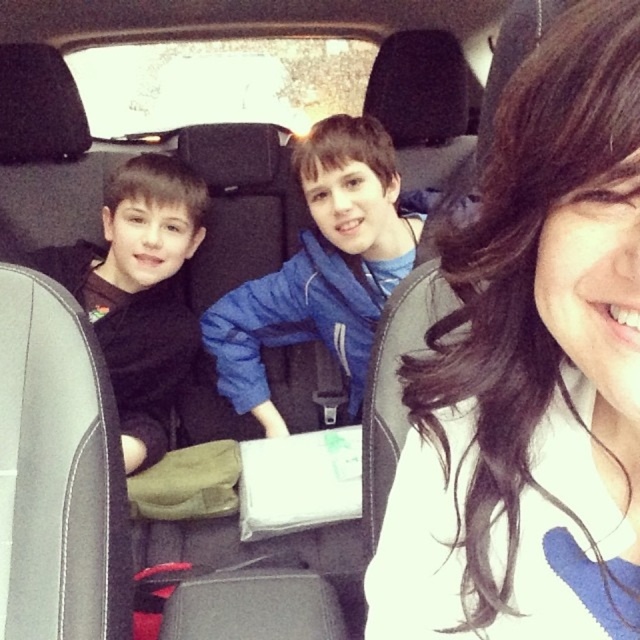
At what (x,y) coordinates should I click in order to perform the action: click on blue fleece jacket at center. Please return your answer as a coordinate pair (x, y). Looking at the image, I should click on (321, 269).

Does blue fleece jacket at center have a greater width compared to black matte jacket at left?

Indeed, blue fleece jacket at center has a greater width compared to black matte jacket at left.

Who is more forward, [328,230] or [152,422]?

Point [328,230] is in front.

This screenshot has height=640, width=640. I want to click on blue fleece jacket at center, so click(x=321, y=269).

Does smooth brown hair at center come behind blue fleece jacket at center?

No, it is not.

Is smooth brown hair at center smaller than blue fleece jacket at center?

Correct, smooth brown hair at center occupies less space than blue fleece jacket at center.

The image size is (640, 640). I want to click on smooth brown hair at center, so [x=531, y=371].

Locate an element on the screen. smooth brown hair at center is located at coordinates (531, 371).

From the picture: Who is more distant from viewer, (x=525, y=332) or (x=116, y=412)?

Positioned behind is point (x=116, y=412).

What are the coordinates of `smooth brown hair at center` in the screenshot? It's located at (531, 371).

The image size is (640, 640). Identify the location of smooth brown hair at center. (531, 371).